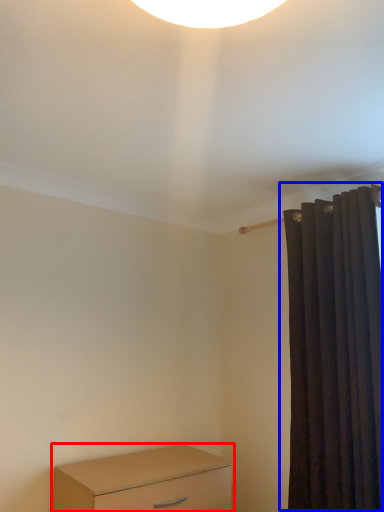
Question: Which object appears farthest to the camera in this image, chest of drawers (highlighted by a red box) or curtain (highlighted by a blue box)?

Choices:
 (A) chest of drawers
 (B) curtain

Answer: (A)